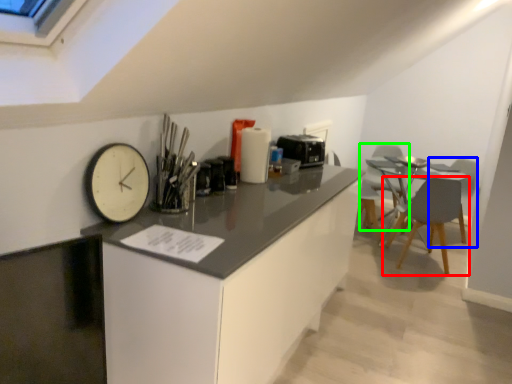
Question: Considering the real-world distances, which object is closest to chair (highlighted by a red box)? armchair (highlighted by a blue box) or swivel chair (highlighted by a green box).

Choices:
 (A) armchair
 (B) swivel chair

Answer: (B)